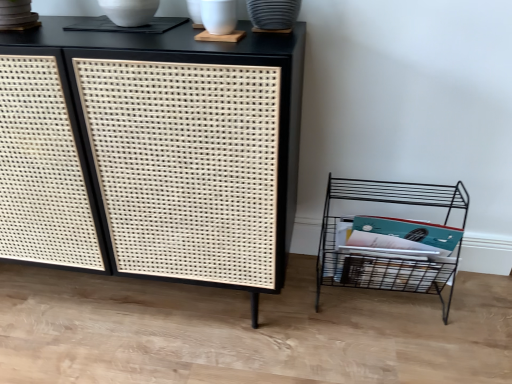
Question: Would you say black wire shelf at lower right is inside or outside black woven cabinet at center?

Choices:
 (A) outside
 (B) inside

Answer: (A)

Question: Considering the relative positions of black wire shelf at lower right and black woven cabinet at center in the image provided, is black wire shelf at lower right to the left or to the right of black woven cabinet at center?

Choices:
 (A) left
 (B) right

Answer: (B)

Question: Looking at their shapes, would you say black wire shelf at lower right is wider or thinner than black woven cabinet at center?

Choices:
 (A) thin
 (B) wide

Answer: (A)

Question: From a real-world perspective, relative to black wire shelf at lower right, is black woven cabinet at center vertically above or below?

Choices:
 (A) above
 (B) below

Answer: (A)

Question: Is point (120, 51) positioned closer to the camera than point (367, 182)?

Choices:
 (A) farther
 (B) closer

Answer: (B)

Question: Is black woven cabinet at center taller or shorter than black wire shelf at lower right?

Choices:
 (A) short
 (B) tall

Answer: (B)

Question: Based on their positions, is black woven cabinet at center located to the left or right of black wire shelf at lower right?

Choices:
 (A) left
 (B) right

Answer: (A)